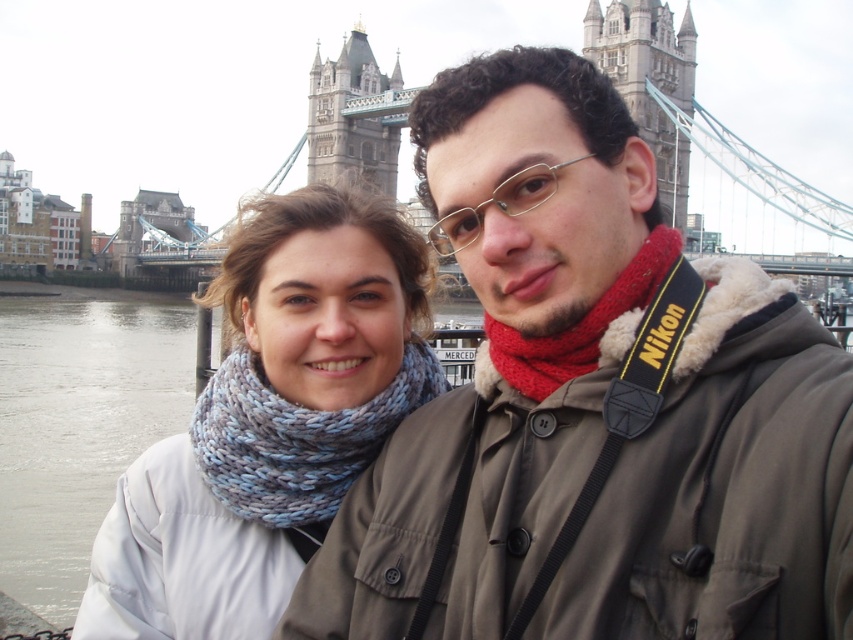
Is point (151, 397) more distant than point (337, 134)?

No, it is not.

Can you confirm if white fabric at lower left is shorter than stone gray tower bridge at upper center?

In fact, white fabric at lower left may be taller than stone gray tower bridge at upper center.

Is point (94, 467) less distant than point (392, 100)?

Yes, it is.

What are the coordinates of `white fabric at lower left` in the screenshot? It's located at (79, 426).

Does matte khaki jacket at center have a greater height compared to white fabric at lower left?

Indeed, matte khaki jacket at center has a greater height compared to white fabric at lower left.

Between point (405, 476) and point (15, 554), which one is positioned in front?

Positioned in front is point (405, 476).

Is point (640, 532) less distant than point (10, 572)?

That is True.

Find the location of `matte khaki jacket at center`. matte khaki jacket at center is located at coordinates (592, 406).

Where is `blue knitted scarf at center`? This screenshot has height=640, width=853. blue knitted scarf at center is located at coordinates pyautogui.click(x=270, y=420).

Between point (303, 323) and point (310, 524), which one is positioned behind?

Point (303, 323)

Identify the location of blue knitted scarf at center. (270, 420).